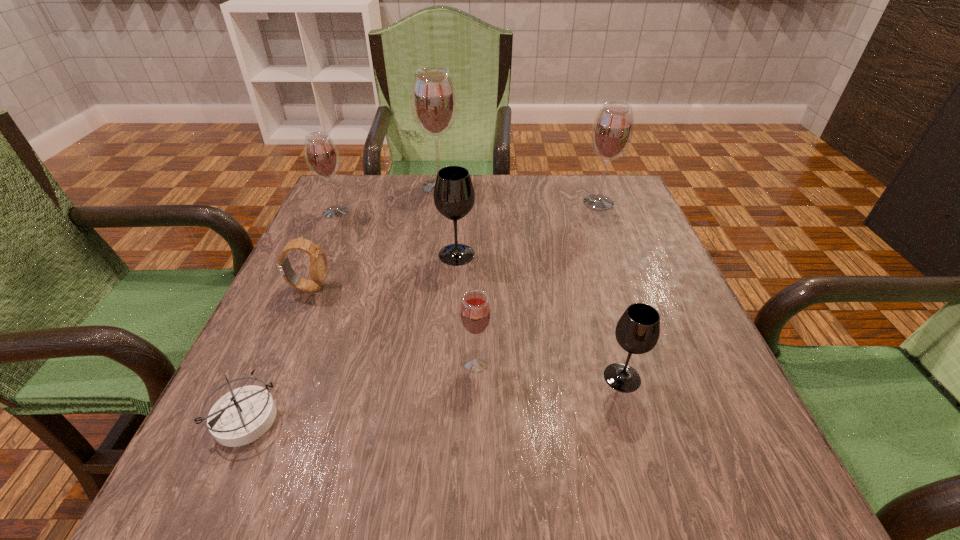
Locate an element on the screen. This screenshot has height=540, width=960. free area in between the third biggest red wineglass and the biggest red wineglass is located at coordinates pyautogui.click(x=388, y=199).

At what (x,y) coordinates should I click in order to perform the action: click on vacant area that lies between the third red wineglass from left to right and the fourth nearest object. Please return your answer as a coordinate pair (x, y). The height and width of the screenshot is (540, 960). Looking at the image, I should click on (393, 324).

The width and height of the screenshot is (960, 540). Find the location of `free spot between the biggest red wineglass and the fifth farthest object`. free spot between the biggest red wineglass and the fifth farthest object is located at coordinates (374, 237).

Find the location of a particular element. The width and height of the screenshot is (960, 540). free point between the tallest object and the leftmost red wineglass is located at coordinates (388, 199).

Identify which object is the sixth nearest to the leftmost red wineglass. Please provide its 2D coordinates. Your answer should be formatted as a tuple, i.e. [(x, y)], where the tuple contains the x and y coordinates of a point satisfying the conditions above.

[(612, 131)]

At what (x,y) coordinates should I click in order to perform the action: click on object that ranks as the sixth closest to the left gray wineglass. Please return your answer as a coordinate pair (x, y). This screenshot has width=960, height=540. Looking at the image, I should click on (637, 331).

Select which wineglass appears as the fifth closest to the smallest red wineglass. Please provide its 2D coordinates. Your answer should be formatted as a tuple, i.e. [(x, y)], where the tuple contains the x and y coordinates of a point satisfying the conditions above.

[(434, 106)]

Identify which wineglass is the fourth closest to the fifth shortest wineglass. Please provide its 2D coordinates. Your answer should be formatted as a tuple, i.e. [(x, y)], where the tuple contains the x and y coordinates of a point satisfying the conditions above.

[(475, 314)]

Find the location of `red wineglass that stands as the closest to the second red wineglass from left to right`. red wineglass that stands as the closest to the second red wineglass from left to right is located at coordinates (321, 155).

Where is `red wineglass that is the third closest to the farther gray wineglass`? The height and width of the screenshot is (540, 960). red wineglass that is the third closest to the farther gray wineglass is located at coordinates (321, 155).